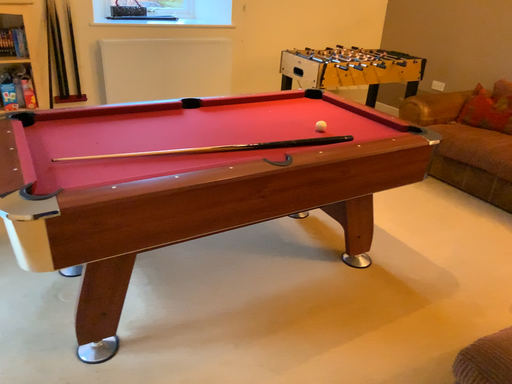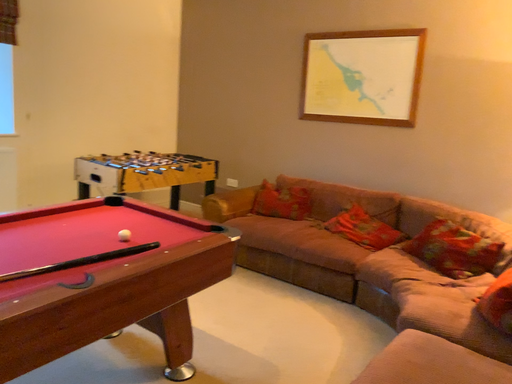
Question: Which way did the camera rotate in the video?

Choices:
 (A) rotated downward
 (B) rotated upward

Answer: (B)